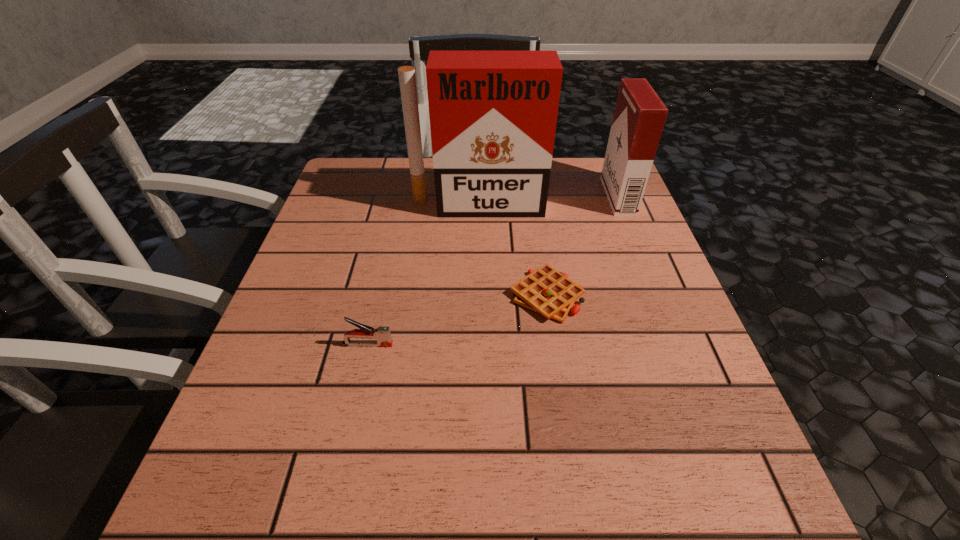
You are a GUI agent. You are given a task and a screenshot of the screen. Output one action in this format:
    pyautogui.click(x=<x>, y=<y>)
    Task: Click on the free spot between the rightmost object and the shortest object
    The width and height of the screenshot is (960, 540).
    Given the screenshot: What is the action you would take?
    pyautogui.click(x=583, y=246)

This screenshot has width=960, height=540. In order to click on empty space between the shortest object and the taller cigarette_case in this screenshot , I will do `click(513, 250)`.

Identify the location of empty space that is in between the waffle and the nearest object. This screenshot has width=960, height=540. (457, 320).

You are a GUI agent. You are given a task and a screenshot of the screen. Output one action in this format:
    pyautogui.click(x=<x>, y=<y>)
    Task: Click on the vacant space in between the shortest object and the left cigarette_case
    This screenshot has width=960, height=540.
    Given the screenshot: What is the action you would take?
    pyautogui.click(x=513, y=250)

Locate which object is the third closest to the third shortest object. Please provide its 2D coordinates. Your answer should be formatted as a tuple, i.e. [(x, y)], where the tuple contains the x and y coordinates of a point satisfying the conditions above.

[(382, 334)]

Identify which object is the second nearest to the rightmost object. Please provide its 2D coordinates. Your answer should be formatted as a tuple, i.e. [(x, y)], where the tuple contains the x and y coordinates of a point satisfying the conditions above.

[(546, 291)]

Image resolution: width=960 pixels, height=540 pixels. Find the location of `vacant area that satisfies the following two spatial constraints: 1. on the front-facing side of the tallest object; 2. on the handle side of the nearest object`. vacant area that satisfies the following two spatial constraints: 1. on the front-facing side of the tallest object; 2. on the handle side of the nearest object is located at coordinates (477, 345).

You are a GUI agent. You are given a task and a screenshot of the screen. Output one action in this format:
    pyautogui.click(x=<x>, y=<y>)
    Task: Click on the free spot that satisfies the following two spatial constraints: 1. on the front-facing side of the taller cigarette_case; 2. on the handle side of the stapler
    This screenshot has width=960, height=540.
    Given the screenshot: What is the action you would take?
    pyautogui.click(x=477, y=345)

Locate an element on the screen. The height and width of the screenshot is (540, 960). vacant area in the image that satisfies the following two spatial constraints: 1. on the front-facing side of the tallest object; 2. on the handle side of the stapler is located at coordinates (477, 345).

The height and width of the screenshot is (540, 960). Find the location of `vacant space that satisfies the following two spatial constraints: 1. on the front-facing side of the second tallest object; 2. on the front-facing side of the tallest object`. vacant space that satisfies the following two spatial constraints: 1. on the front-facing side of the second tallest object; 2. on the front-facing side of the tallest object is located at coordinates (621, 205).